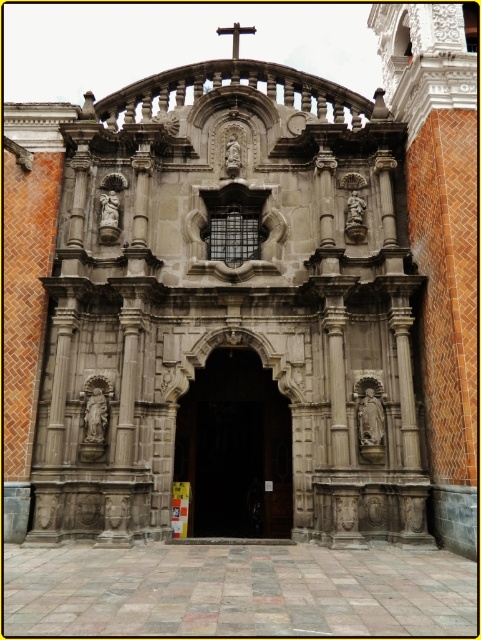
You are a visitor approaching the church and want to enter. You see the dark wood door at center and the wooden cross at center. Which object should you interact with to enter the church?

The dark wood door at center is larger in size than the wooden cross at center, so you should interact with the dark wood door at center to enter the church.

You are standing at the entrance of the historic church and notice two points marked on the facade. The first point is at coordinates point (224, 484) and the second is at point (242, 28). From your vantage point, which point appears closer to you?

Point (224, 484) is in front of point (242, 28), so it appears closer to you.